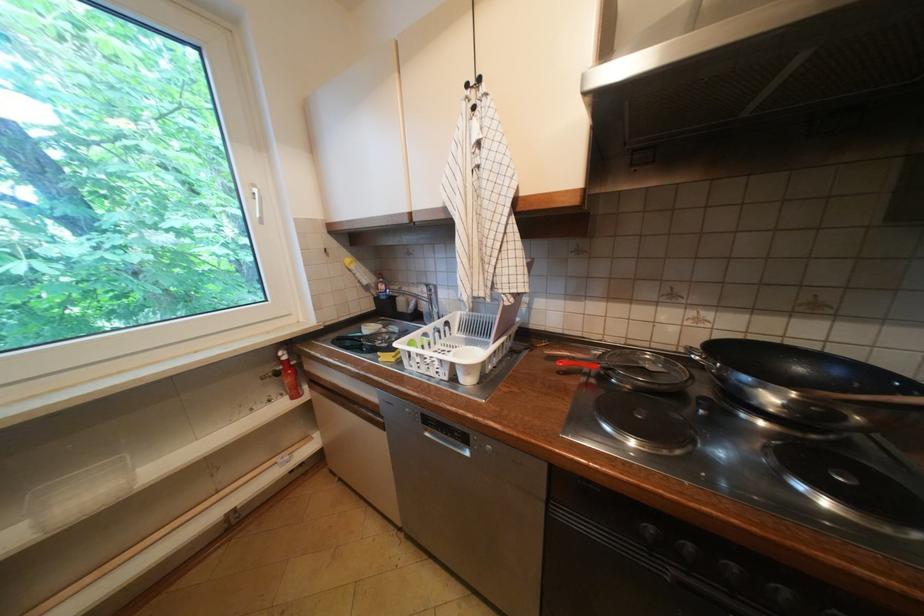
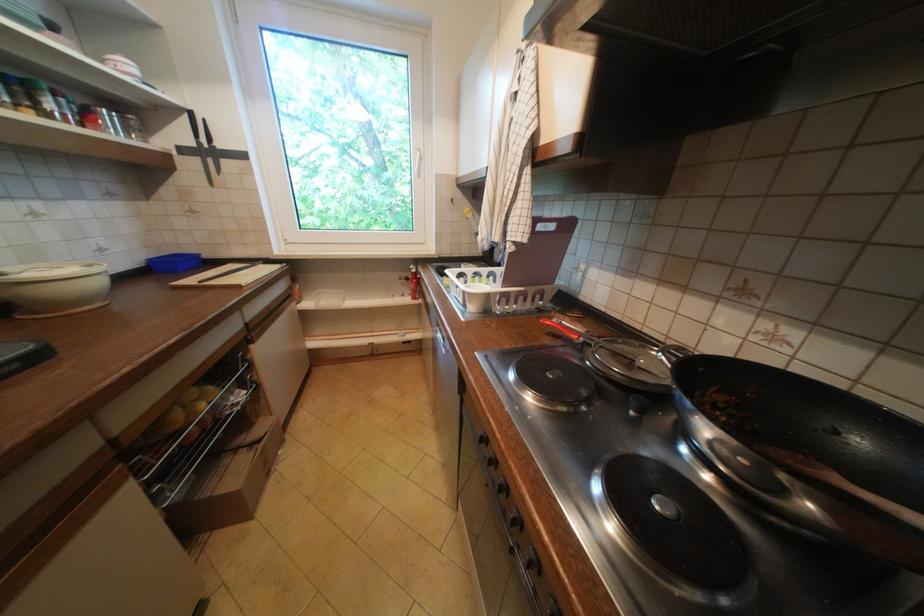
The point at (x=277, y=402) is marked in the first image. Where is the corresponding point in the second image?

(410, 296)